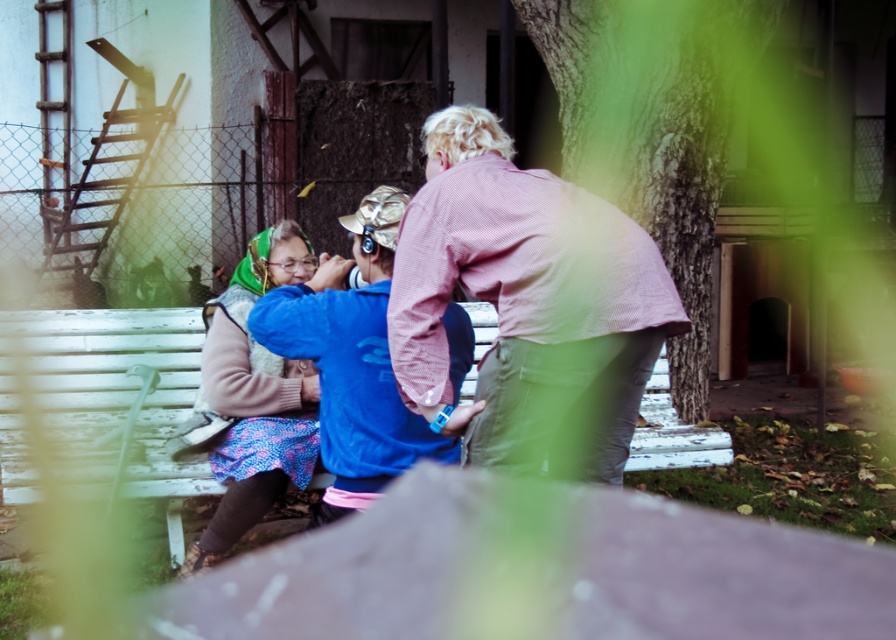
You are a photographer trying to capture a closeup of the blue fleece jacket at center and matte green scarf at left. Which object should you zoom in on first to ensure both are in focus?

The blue fleece jacket at center is shorter than matte green scarf at left, so you should focus on the matte green scarf at left first to ensure both are in focus since it is closer to the camera.

From the picture: You are standing at the point marked by the coordinates point (352, 362). Looking around, you see a blue fleece jacket at center. Which direction should you face to see the older woman wearing glasses, pink sweater, and pattern?

The blue fleece jacket at center is located at point (352, 362). The older woman wearing glasses, pink sweater, and pattern is on the left side of the bench. To face her from the point, you should turn to your left.

You are standing in front of the bench and want to place a small flowerpot between the two points marked as point (521, 237) and point (27, 333). Which point should the flowerpot be closer to if it needs to be placed nearer to the camera?

The flowerpot should be placed closer to point (521, 237) because it is closer to the camera than point (27, 333).